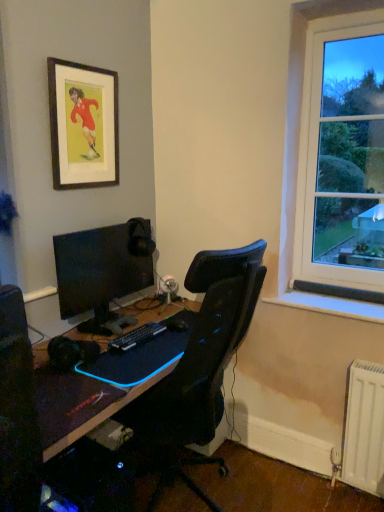
Question: Should I look upward or downward to see metallic silver speaker at center?

Choices:
 (A) down
 (B) up

Answer: (A)

Question: Does black glossy monitor at left come in front of metallic silver speaker at center?

Choices:
 (A) no
 (B) yes

Answer: (B)

Question: From the image's perspective, would you say black glossy monitor at left is shown under metallic silver speaker at center?

Choices:
 (A) yes
 (B) no

Answer: (B)

Question: Is black glossy monitor at left taller than metallic silver speaker at center?

Choices:
 (A) no
 (B) yes

Answer: (B)

Question: Are black glossy monitor at left and metallic silver speaker at center beside each other?

Choices:
 (A) yes
 (B) no

Answer: (B)

Question: Can you confirm if black glossy monitor at left is smaller than metallic silver speaker at center?

Choices:
 (A) yes
 (B) no

Answer: (B)

Question: Is metallic silver speaker at center inside black glossy monitor at left?

Choices:
 (A) no
 (B) yes

Answer: (A)

Question: Can you confirm if black plastic keyboard at center is shorter than metallic silver speaker at center?

Choices:
 (A) no
 (B) yes

Answer: (B)

Question: Considering the relative sizes of black plastic keyboard at center and metallic silver speaker at center in the image provided, is black plastic keyboard at center bigger than metallic silver speaker at center?

Choices:
 (A) yes
 (B) no

Answer: (B)

Question: Is black plastic keyboard at center far away from metallic silver speaker at center?

Choices:
 (A) no
 (B) yes

Answer: (A)

Question: Is black plastic keyboard at center at the left side of metallic silver speaker at center?

Choices:
 (A) yes
 (B) no

Answer: (A)

Question: Does black plastic keyboard at center lie behind metallic silver speaker at center?

Choices:
 (A) yes
 (B) no

Answer: (B)

Question: Is black plastic keyboard at center outside metallic silver speaker at center?

Choices:
 (A) no
 (B) yes

Answer: (B)

Question: Is metallic silver speaker at center surrounded by black matte desk at center?

Choices:
 (A) yes
 (B) no

Answer: (B)